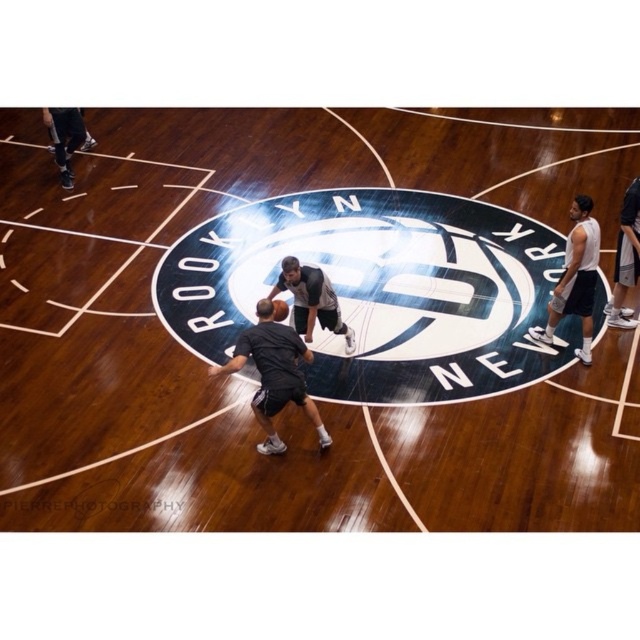
Question: Can you confirm if black matte shorts at upper left is wider than shiny orange basketball at center?

Choices:
 (A) yes
 (B) no

Answer: (A)

Question: Which object appears closest to the camera in this image?

Choices:
 (A) black matte shorts at upper left
 (B) dark gray shorts at center
 (C) dark gray shorts at right
 (D) shiny orange basketball at center

Answer: (B)

Question: Among these objects, which one is farthest from the camera?

Choices:
 (A) dark gray shorts at center
 (B) wooden basketball court at center
 (C) gray matte basketball player at center
 (D) dark gray shorts at right

Answer: (D)

Question: Among these points, which one is nearest to the camera?

Choices:
 (A) (630, 209)
 (B) (276, 320)
 (C) (52, 499)

Answer: (C)

Question: Where is gray matte basketball player at center located in relation to black matte shorts at upper left in the image?

Choices:
 (A) below
 (B) above

Answer: (A)

Question: Where is dark gray shorts at right located in relation to shiny orange basketball at center in the image?

Choices:
 (A) left
 (B) right

Answer: (B)